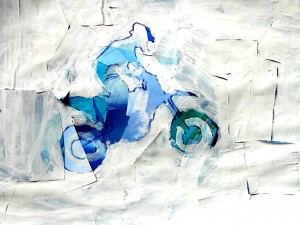
Where is `seat`? The image size is (300, 225). seat is located at coordinates (94, 94).